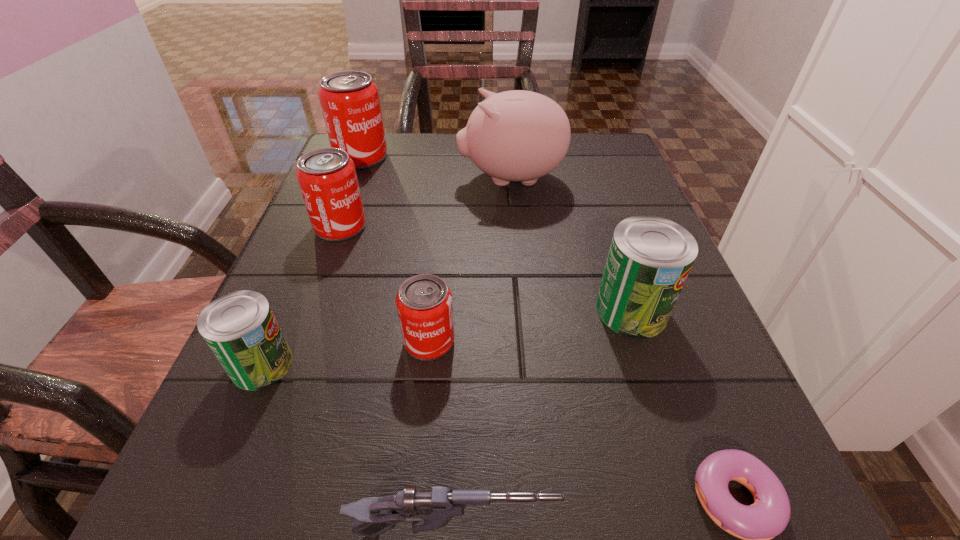
Where is `piggy bank`? This screenshot has height=540, width=960. piggy bank is located at coordinates (517, 135).

You are a GUI agent. You are given a task and a screenshot of the screen. Output one action in this format:
    pyautogui.click(x=<x>, y=<y>)
    Task: Click on the farthest red can
    This screenshot has width=960, height=540.
    Given the screenshot: What is the action you would take?
    pyautogui.click(x=349, y=100)

The height and width of the screenshot is (540, 960). What are the coordinates of `the farthest can` in the screenshot? It's located at (349, 100).

Where is `the sixth nearest object`? the sixth nearest object is located at coordinates click(327, 177).

Image resolution: width=960 pixels, height=540 pixels. Identify the location of the second smallest red can. (327, 177).

I want to click on the farther green can, so click(x=650, y=257).

Where is `the rightmost can`? The height and width of the screenshot is (540, 960). the rightmost can is located at coordinates (650, 257).

Find the location of a particular element. The width and height of the screenshot is (960, 540). the rightmost red can is located at coordinates (424, 304).

Identify the location of the nearest red can. Image resolution: width=960 pixels, height=540 pixels. (424, 304).

Find the location of a particular element. the left green can is located at coordinates (240, 328).